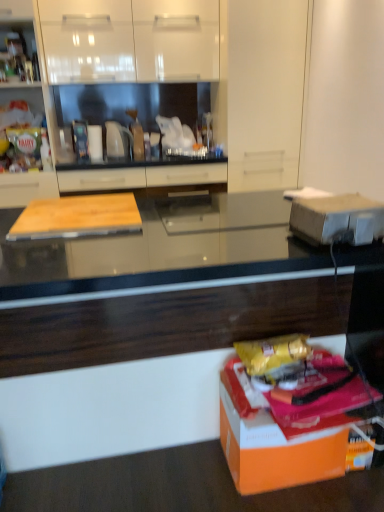
This screenshot has height=512, width=384. I want to click on blank space situated above white cardboard box at right, the second cardboard box in the bottom-to-top sequence (from a real-world perspective), so click(x=347, y=202).